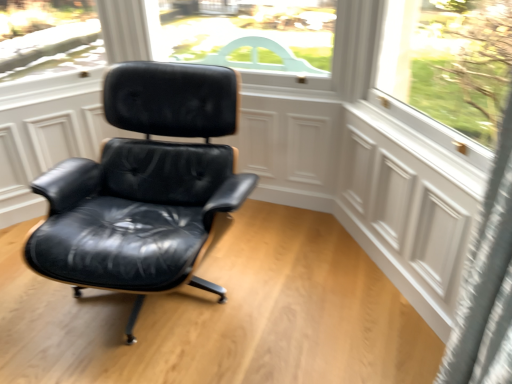
This screenshot has height=384, width=512. I want to click on blank space above white matte screen door at right (from a real-world perspective), so click(421, 140).